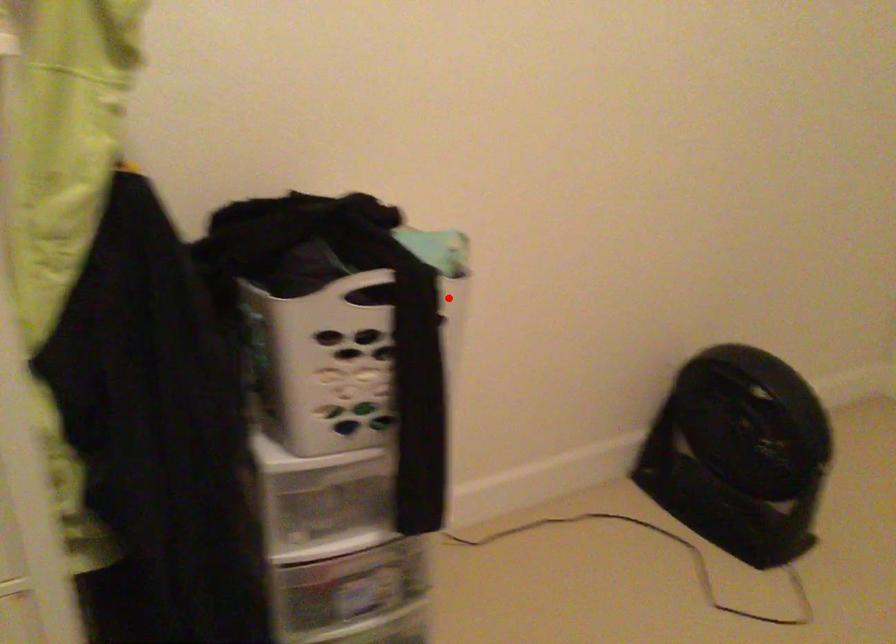
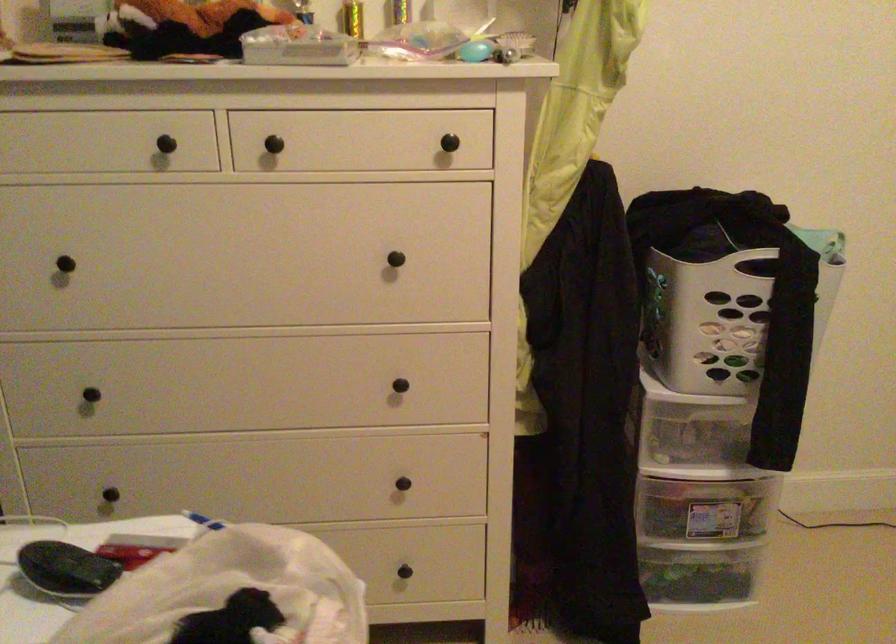
Where in the second image is the point corresponding to the highlighted location from the first image?

(829, 277)